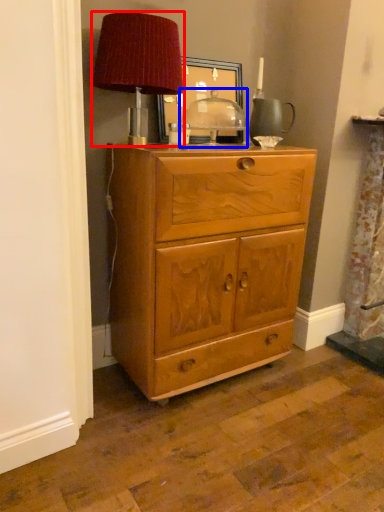
Question: Which object appears closest to the camera in this image, table lamp (highlighted by a red box) or table (highlighted by a blue box)?

Choices:
 (A) table lamp
 (B) table

Answer: (A)